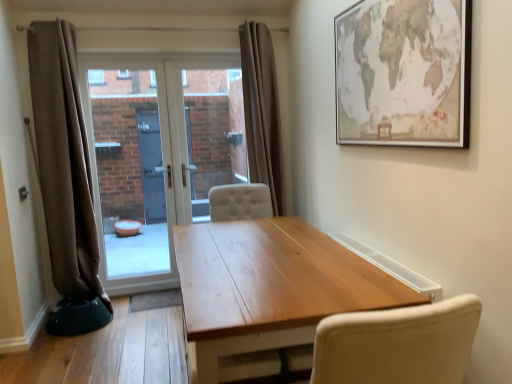
Where is `vacant area on top of transparent glass door at center, which is counted as the 1th window screen, starting from the left (from a real-world perspective)`? The width and height of the screenshot is (512, 384). vacant area on top of transparent glass door at center, which is counted as the 1th window screen, starting from the left (from a real-world perspective) is located at coordinates (117, 61).